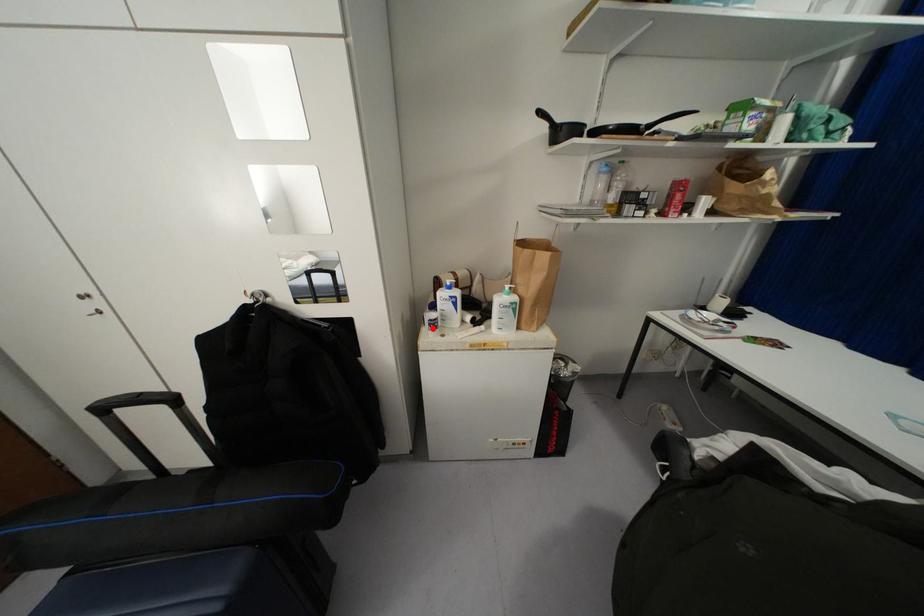
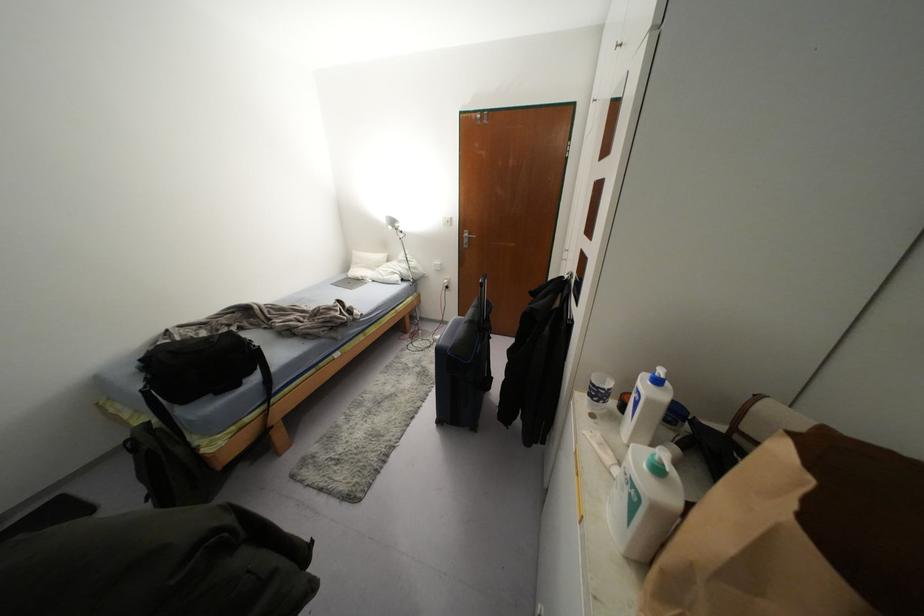
Question: A red point is marked in image1. In image2, is the corresponding 3D point closer to the camera or farther? Reply with the corresponding letter.

Choices:
 (A) The corresponding 3D point is closer.
 (B) The corresponding 3D point is farther.

Answer: (A)